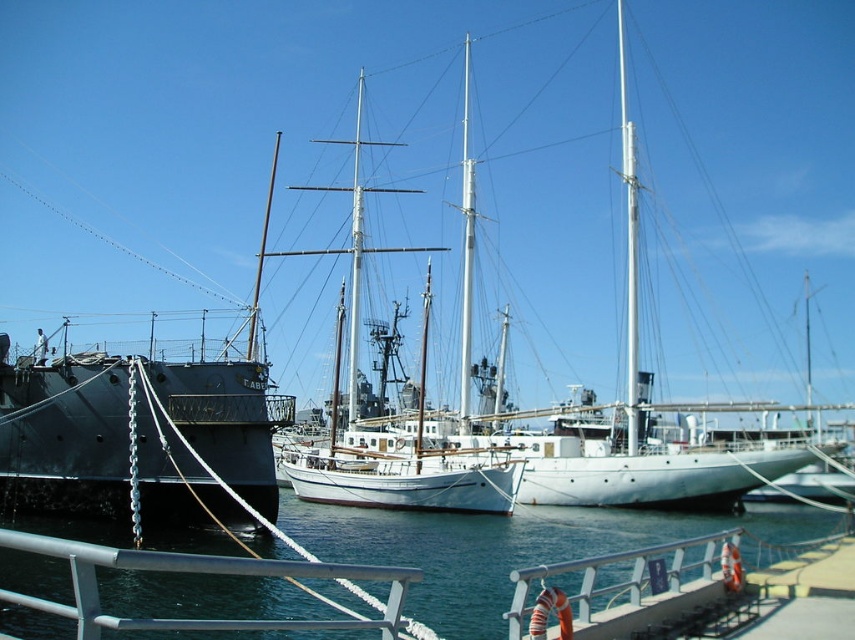
Question: Is clear blue water at center smaller than matte black ship at left?

Choices:
 (A) yes
 (B) no

Answer: (B)

Question: Can you confirm if clear blue water at center is positioned to the left of white matte mast at center?

Choices:
 (A) no
 (B) yes

Answer: (B)

Question: Among these points, which one is nearest to the camera?

Choices:
 (A) (629, 422)
 (B) (460, 371)
 (C) (486, 568)

Answer: (C)

Question: Considering the real-world distances, which object is farthest from the matte black ship at left?

Choices:
 (A) white matte sailboat at center
 (B) white metallic mast at center

Answer: (A)

Question: Does clear blue water at center have a lesser width compared to white metallic mast at center?

Choices:
 (A) no
 (B) yes

Answer: (A)

Question: Which object is closer to the camera taking this photo?

Choices:
 (A) matte black ship at left
 (B) clear blue water at center
 (C) white matte sailboat at center
 (D) white matte mast at center

Answer: (B)